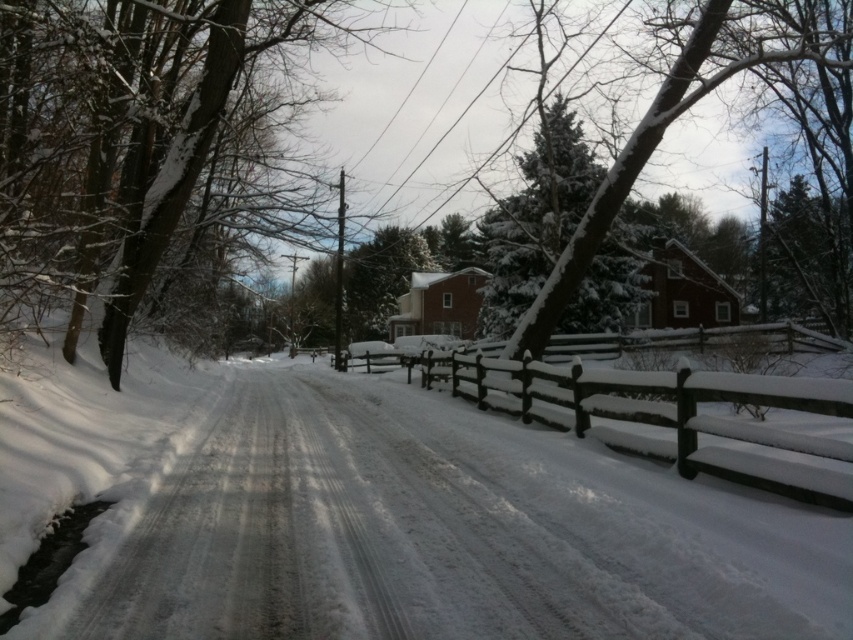
Question: Which object is closer to the camera taking this photo?

Choices:
 (A) snow-covered evergreen at center
 (B) snow-covered wooden fence at right
 (C) white powdery snow at center
 (D) snow-covered wooden fence at center

Answer: (C)

Question: Where is snow-covered tree at left located in relation to snow-covered wooden fence at right in the image?

Choices:
 (A) below
 (B) above

Answer: (B)

Question: Estimate the real-world distances between objects in this image. Which object is closer to the white powdery snow at center?

Choices:
 (A) snow-covered wooden fence at center
 (B) snow-covered tree at left
 (C) snow-covered wooden fence at right
 (D) snow-covered evergreen at center

Answer: (A)

Question: Is snow-covered tree at left positioned before snow-covered wooden fence at right?

Choices:
 (A) yes
 (B) no

Answer: (A)

Question: Does white powdery snow at center have a lesser width compared to snow-covered tree at left?

Choices:
 (A) yes
 (B) no

Answer: (B)

Question: Which object is positioned farthest from the snow-covered wooden fence at right?

Choices:
 (A) snow-covered wooden fence at center
 (B) snow-covered evergreen at center

Answer: (A)